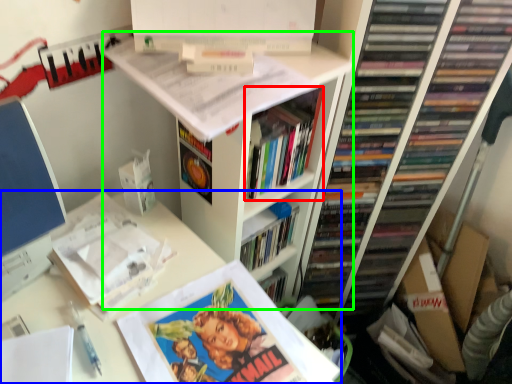
Question: Which object is positioned farthest from book (highlighted by a red box)? Select from computer desk (highlighted by a blue box) and bookshelf (highlighted by a green box).

Choices:
 (A) computer desk
 (B) bookshelf

Answer: (A)